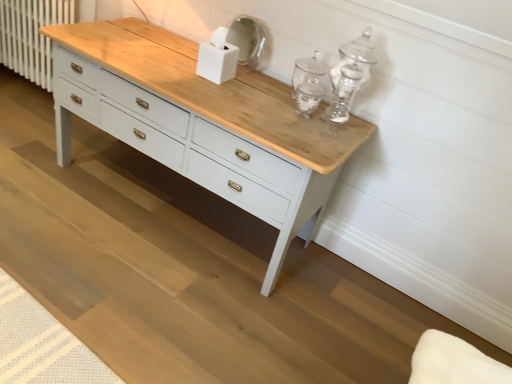
Find the location of a particular element. white painted radiator at left is located at coordinates (31, 36).

Measure the distance between point (15, 56) and camera.

Point (15, 56) is 2.96 meters away from camera.

Describe the element at coordinates (31, 36) in the screenshot. I see `white painted radiator at left` at that location.

This screenshot has width=512, height=384. In order to click on white painted radiator at left in this screenshot , I will do `click(31, 36)`.